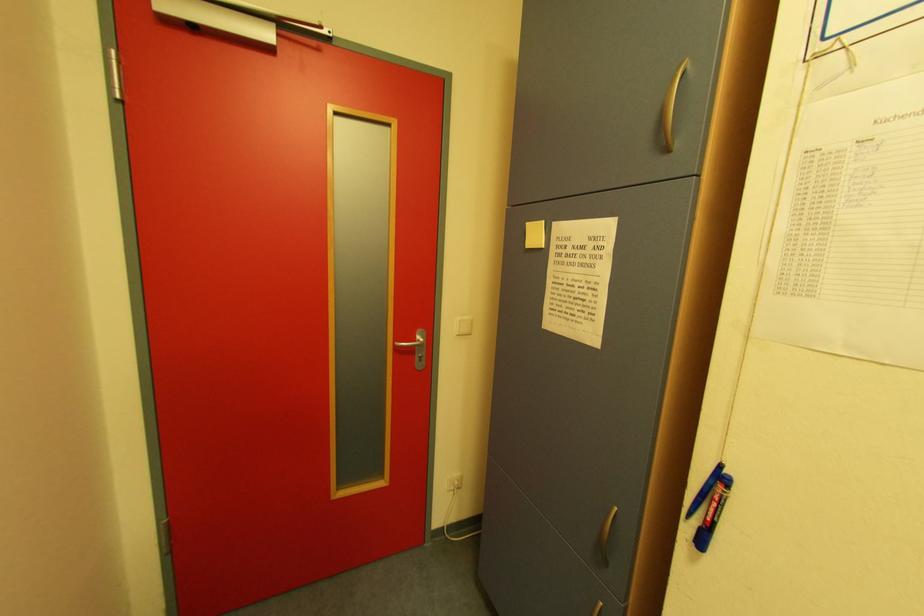
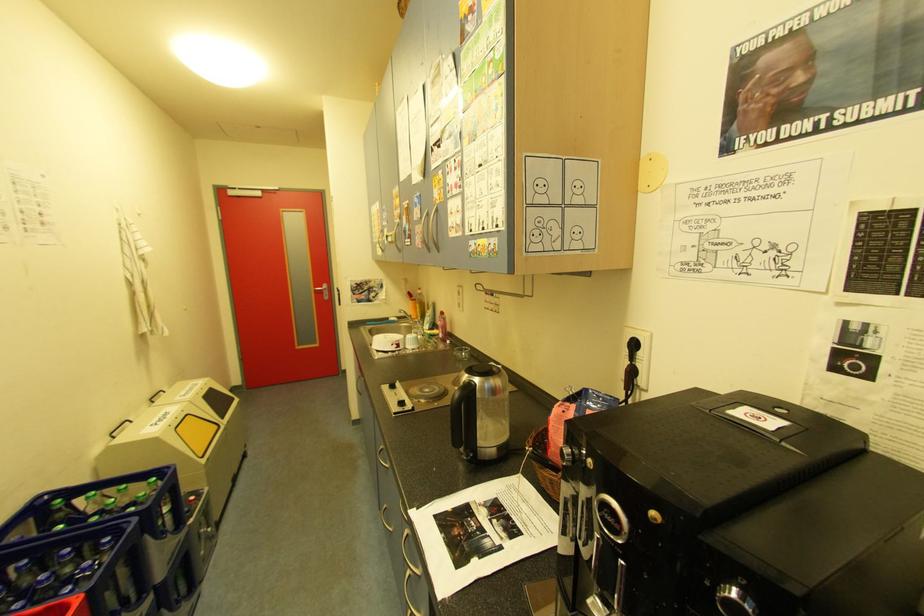
Which direction would the cameraman need to move to produce the second image?

The cameraman walked toward right, backward.